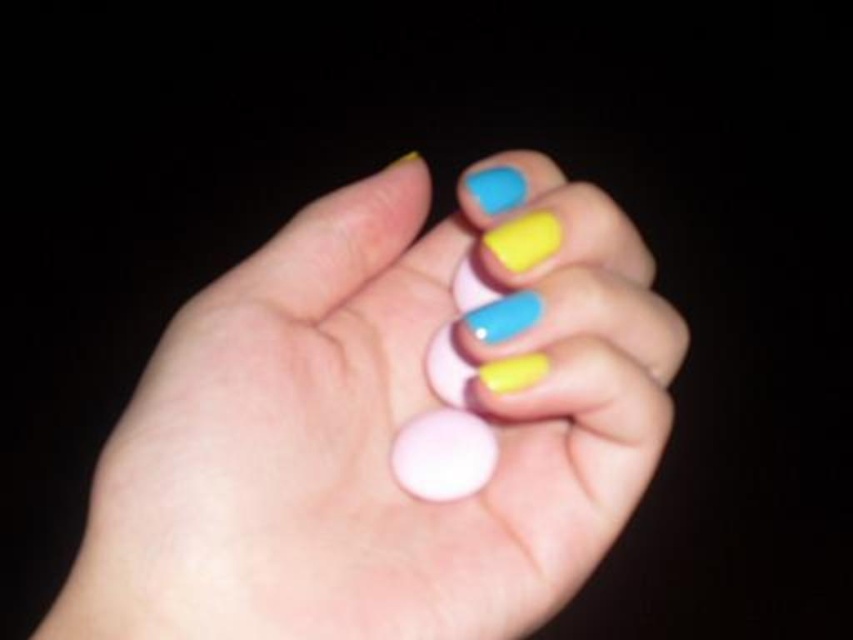
You are a makeup artist preparing for a client. You have a matte plastic hand at center and a matte blue nail polish at center. Which object is positioned higher in the image?

The matte blue nail polish at center is positioned higher than the matte plastic hand at center.

You are a makeup artist preparing for a client. You need to place the matte blue nail polish at center onto the matte plastic hand at center. Based on the image, can you determine if the nail polish will fit on the hand?

The matte plastic hand at center is much taller than the matte blue nail polish at center, so yes, the nail polish will fit on the hand since it is smaller in height.

You are a nail technician preparing to apply polish to the matte plastic hand at center. You have the matte blue nail polish at center. Considering their sizes, will the polish bottle fit comfortably in your hand while working?

The matte plastic hand at center is larger in size than the matte blue nail polish at center, so the polish bottle will fit comfortably in your hand while working.